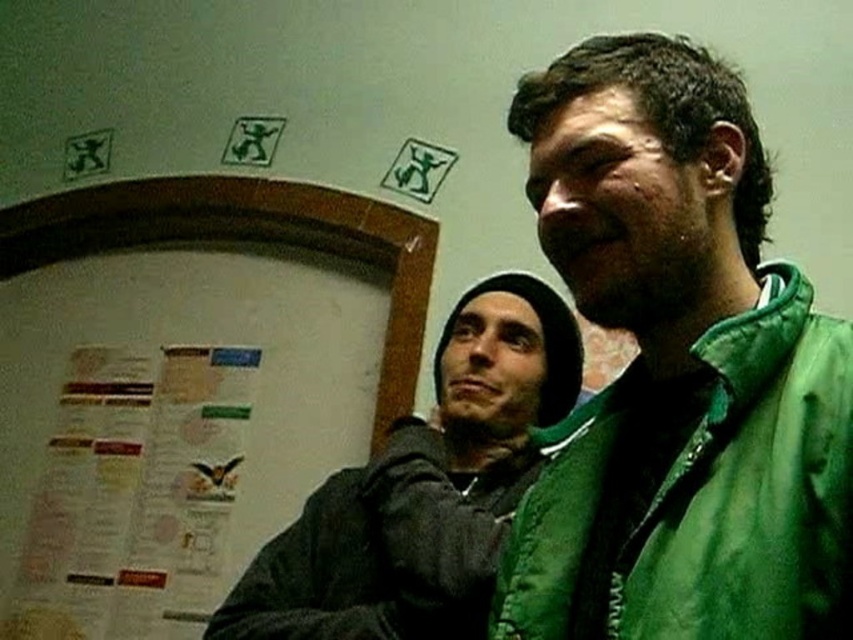
Is white paper at left closer to camera compared to paper poster at left?

That is True.

Between point (260, 234) and point (209, 352), which one is positioned in front?

Positioned in front is point (209, 352).

You are a GUI agent. You are given a task and a screenshot of the screen. Output one action in this format:
    pyautogui.click(x=<x>, y=<y>)
    Task: Click on the white paper at left
    Image resolution: width=853 pixels, height=640 pixels.
    Given the screenshot: What is the action you would take?
    pyautogui.click(x=186, y=385)

Image resolution: width=853 pixels, height=640 pixels. In order to click on white paper at left in this screenshot , I will do `click(186, 385)`.

Consider the image. Between white paper at left and green quilted jacket at right, which one is positioned lower?

white paper at left is lower down.

Is white paper at left further to camera compared to green quilted jacket at right?

Yes, white paper at left is further from the viewer.

Image resolution: width=853 pixels, height=640 pixels. What do you see at coordinates (186, 385) in the screenshot?
I see `white paper at left` at bounding box center [186, 385].

Image resolution: width=853 pixels, height=640 pixels. Find the location of `white paper at left`. white paper at left is located at coordinates pos(186,385).

Which is in front, point (817, 579) or point (142, 561)?

Point (817, 579) is more forward.

Does point (811, 531) come farther from viewer compared to point (38, 529)?

No, (811, 531) is in front of (38, 529).

Locate an element on the screen. The image size is (853, 640). green quilted jacket at right is located at coordinates (752, 486).

This screenshot has width=853, height=640. In order to click on green quilted jacket at right in this screenshot , I will do tap(752, 486).